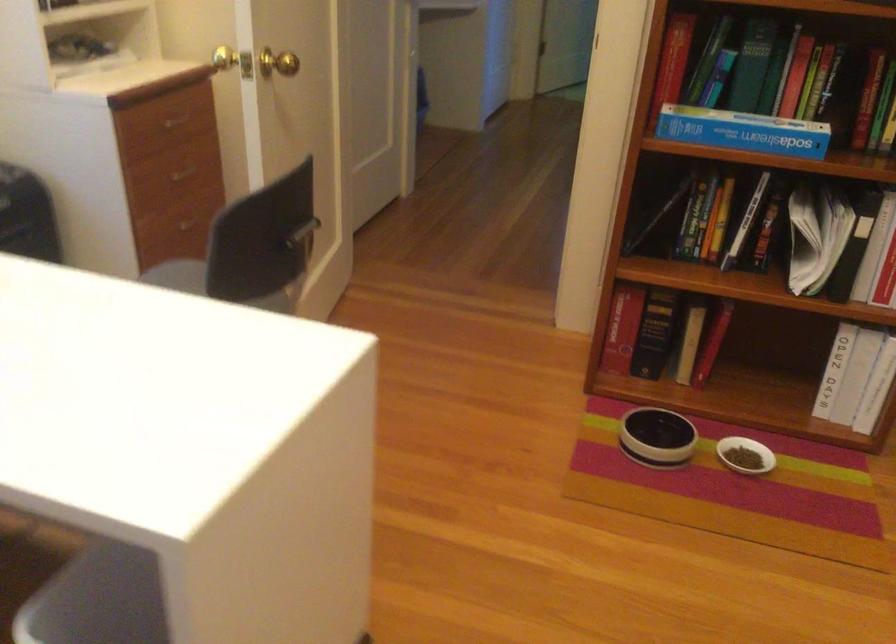
What do you see at coordinates (233, 61) in the screenshot?
I see `the brass door knob` at bounding box center [233, 61].